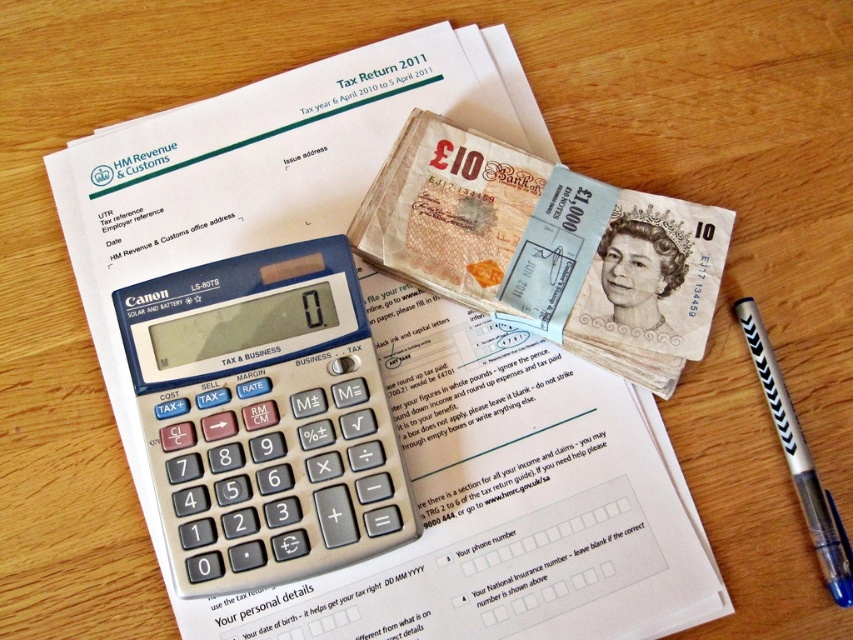
Looking at this image, does silver metallic calculator at center have a smaller size compared to black plastic pen at lower right?

Incorrect, silver metallic calculator at center is not smaller in size than black plastic pen at lower right.

This screenshot has height=640, width=853. In order to click on silver metallic calculator at center in this screenshot , I will do `click(264, 419)`.

Where is `silver metallic calculator at center`? The image size is (853, 640). silver metallic calculator at center is located at coordinates (264, 419).

Where is `light brown paper money at center`? light brown paper money at center is located at coordinates (546, 248).

Is point (606, 312) closer to camera compared to point (819, 548)?

No.

Image resolution: width=853 pixels, height=640 pixels. What are the coordinates of `light brown paper money at center` in the screenshot? It's located at (546, 248).

Between silver metallic calculator at center and light brown paper money at center, which one is positioned lower?

silver metallic calculator at center

Describe the element at coordinates (264, 419) in the screenshot. I see `silver metallic calculator at center` at that location.

Where is `silver metallic calculator at center`? This screenshot has height=640, width=853. silver metallic calculator at center is located at coordinates (264, 419).